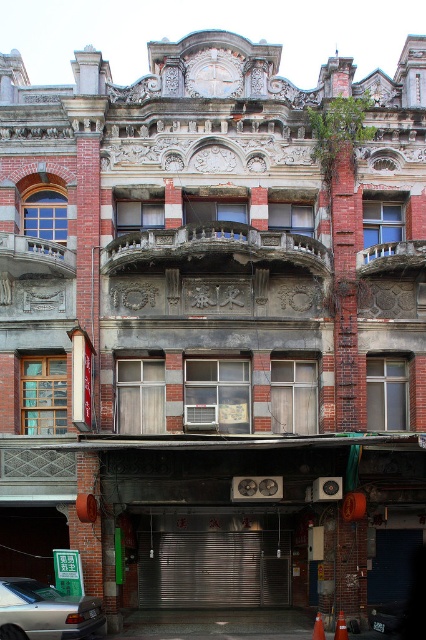
You are a delivery person trying to place an orange matte traffic cone at center and an orange plastic cone at center on the ground in front of the building. The building has a balcony with a curved railing at the center. Which cone should you place closer to the balcony to ensure visibility from above?

The orange plastic cone at center should be placed closer to the balcony because it is taller than the orange matte traffic cone at center, making it more visible from above.

You are a delivery person trying to park your van near the orange matte traffic cone at center and the orange plastic cone at center. Which cone is placed higher up on the ground?

The orange matte traffic cone at center is positioned over the orange plastic cone at center, so it is placed higher up on the ground.